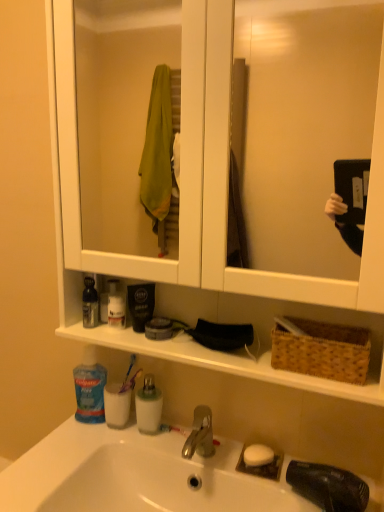
Locate an element on the screen. The width and height of the screenshot is (384, 512). blank area to the left of purple plastic toothbrush at lower center is located at coordinates (77, 426).